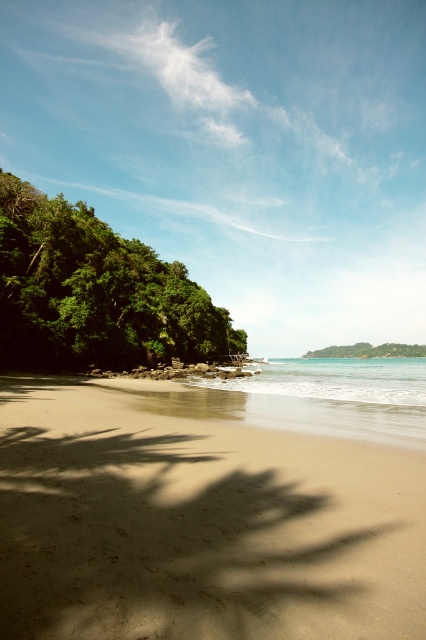
Question: Which object is positioned farthest from the sandy beach at lower left?

Choices:
 (A) green leafy tree at center
 (B) clear blue water at center
 (C) green leafy tree at left

Answer: (A)

Question: Which of the following is the farthest from the observer?

Choices:
 (A) (311, 358)
 (B) (224, 563)

Answer: (A)

Question: Can you confirm if sandy beach at lower left is positioned above green leafy tree at center?

Choices:
 (A) no
 (B) yes

Answer: (B)

Question: Can you confirm if green leafy tree at left is bigger than clear blue water at center?

Choices:
 (A) yes
 (B) no

Answer: (B)

Question: Considering the real-world distances, which object is farthest from the green leafy tree at center?

Choices:
 (A) green leafy tree at left
 (B) clear blue water at center
 (C) sandy beach at lower left

Answer: (C)

Question: Is sandy beach at lower left bigger than clear blue water at center?

Choices:
 (A) yes
 (B) no

Answer: (B)